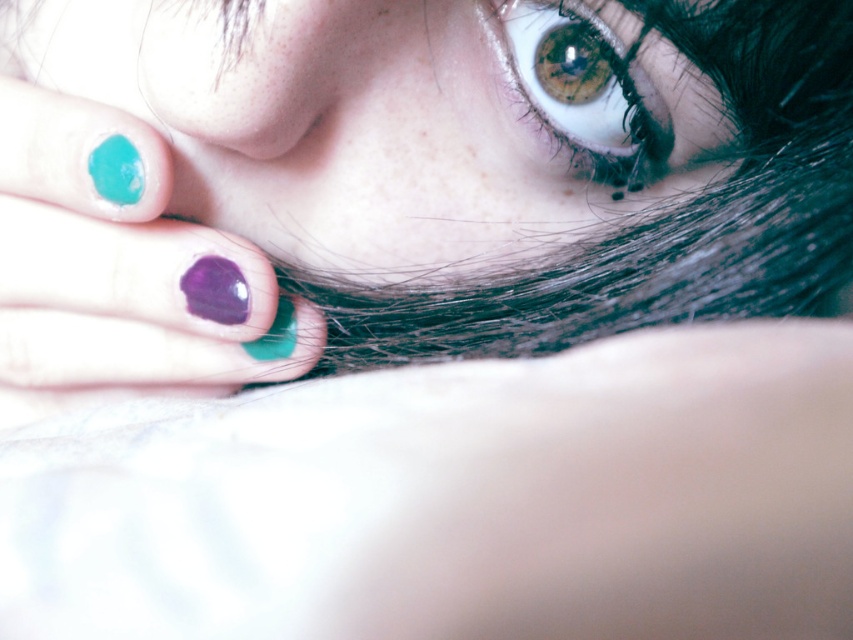
Question: Considering the relative positions of teal glossy nail polish at lower left and purple glossy nail polish at center in the image provided, where is teal glossy nail polish at lower left located with respect to purple glossy nail polish at center?

Choices:
 (A) below
 (B) above

Answer: (A)

Question: Which of these objects is positioned farthest from the brown matte eye at upper center?

Choices:
 (A) teal glossy nail polish at lower left
 (B) purple glossy nail polish at center

Answer: (A)

Question: Does teal glossy nails at upper left have a lesser width compared to teal glossy nail polish at lower left?

Choices:
 (A) no
 (B) yes

Answer: (A)

Question: Which object appears farthest from the camera in this image?

Choices:
 (A) teal glossy nails at upper left
 (B) teal glossy nail polish at lower left
 (C) brown matte eye at upper center
 (D) purple glossy nail polish at center

Answer: (D)

Question: Which is nearer to the purple glossy nail polish at center?

Choices:
 (A) teal glossy nail polish at lower left
 (B) brown matte eye at upper center

Answer: (A)

Question: Is brown matte eye at upper center further to camera compared to purple glossy nail polish at center?

Choices:
 (A) no
 (B) yes

Answer: (A)